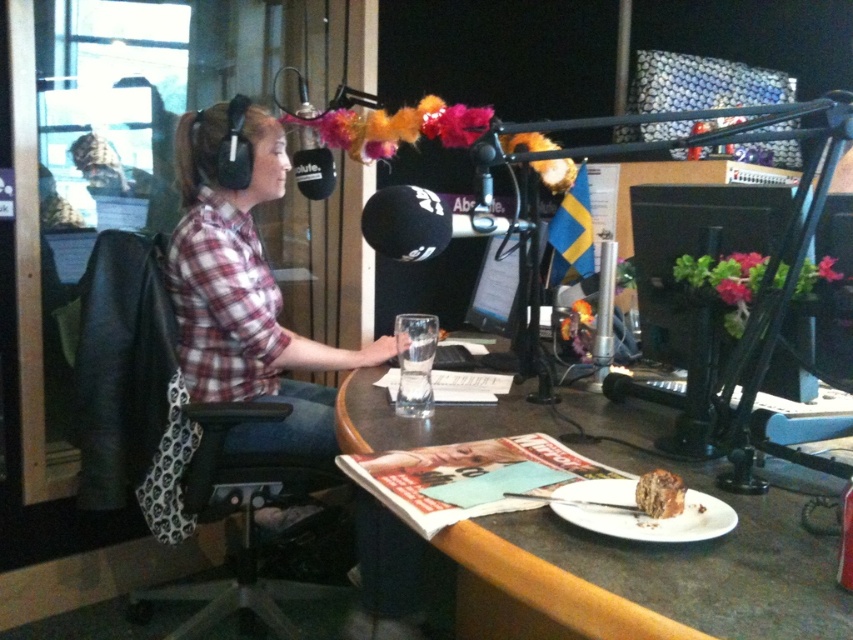
Question: Which of the following is the farthest from the observer?

Choices:
 (A) brown crumbly cake at lower right
 (B) black fabric swivel chair at left

Answer: (B)

Question: Can you confirm if smooth brown table at center is bigger than black fabric swivel chair at left?

Choices:
 (A) no
 (B) yes

Answer: (A)

Question: Where is black fabric swivel chair at left located in relation to brown crumbly cake at lower right in the image?

Choices:
 (A) right
 (B) left

Answer: (B)

Question: Considering the real-world distances, which object is closest to the brown crumbly cake at lower right?

Choices:
 (A) plaid shirt at center
 (B) black fabric swivel chair at left

Answer: (A)

Question: Which object is positioned closest to the black fabric swivel chair at left?

Choices:
 (A) smooth brown table at center
 (B) brown crumbly cake at lower right
 (C) plaid shirt at center

Answer: (C)

Question: Does smooth brown table at center have a smaller size compared to brown crumbly cake at lower right?

Choices:
 (A) no
 (B) yes

Answer: (A)